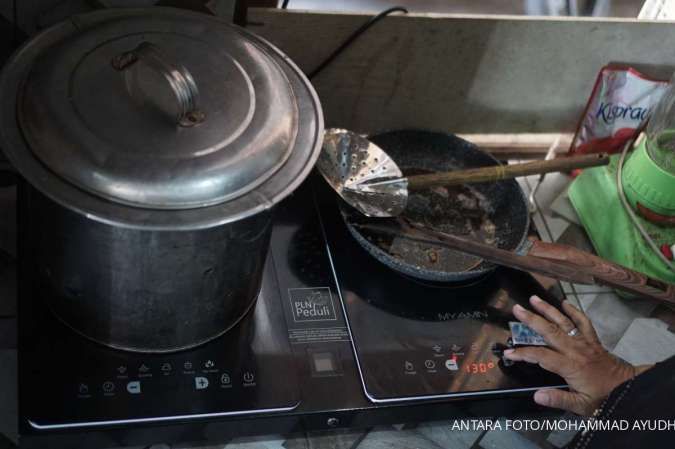
Where is `frying pan`? Image resolution: width=675 pixels, height=449 pixels. frying pan is located at coordinates (432, 257).